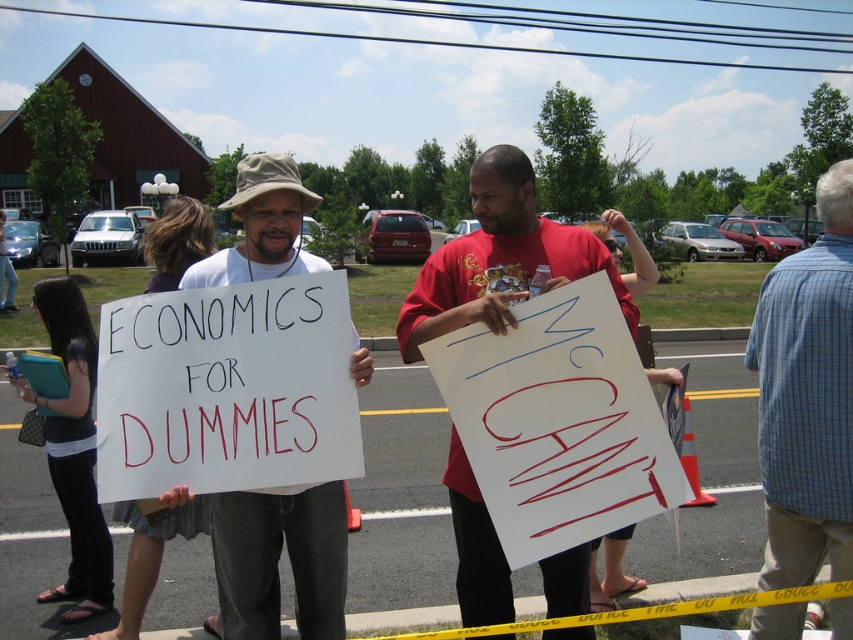
Does blue plaid shirt at upper right have a lesser height compared to white paper sign at center?

No, blue plaid shirt at upper right is not shorter than white paper sign at center.

What do you see at coordinates (807, 397) in the screenshot?
I see `blue plaid shirt at upper right` at bounding box center [807, 397].

Where is `blue plaid shirt at upper right`? This screenshot has width=853, height=640. blue plaid shirt at upper right is located at coordinates (807, 397).

Is red cotton shirt at center further to the viewer compared to white paper sign at center?

No, red cotton shirt at center is closer to the viewer.

Who is higher up, red cotton shirt at center or white paper sign at center?

red cotton shirt at center is above.

Is point (421, 292) behind point (260, 502)?

That is True.

Where is `red cotton shirt at center`? red cotton shirt at center is located at coordinates (498, 259).

Is blue plaid shirt at upper right behind red cotton shirt at center?

Yes, blue plaid shirt at upper right is further from the viewer.

Is blue plaid shirt at upper right wider than red cotton shirt at center?

No, blue plaid shirt at upper right is not wider than red cotton shirt at center.

Who is more distant from viewer, (825, 481) or (561, 240)?

Point (561, 240)

The height and width of the screenshot is (640, 853). What are the coordinates of `blue plaid shirt at upper right` in the screenshot? It's located at (807, 397).